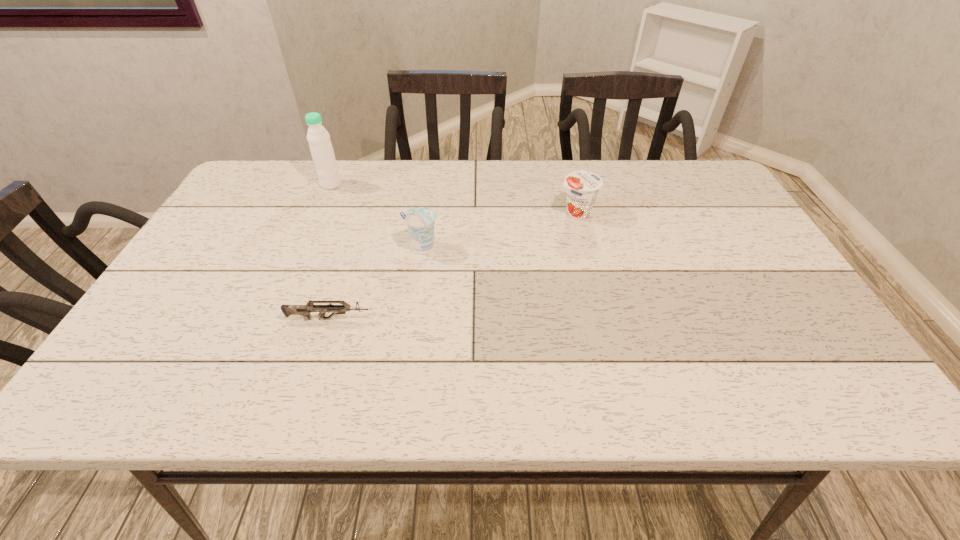
Find the location of a particular element. This screenshot has height=540, width=960. vacant space located on the back of the nearer yogurt is located at coordinates coord(428,200).

Locate an element on the screen. This screenshot has width=960, height=540. free point located aimed along the barrel of the gun is located at coordinates (551, 319).

Find the location of a particular element. This screenshot has width=960, height=540. water bottle located in the far edge section of the desktop is located at coordinates (318, 137).

Locate an element on the screen. This screenshot has width=960, height=540. yogurt at the far edge is located at coordinates [x=582, y=187].

The width and height of the screenshot is (960, 540). I want to click on free space at the far edge of the desktop, so click(x=395, y=163).

In the image, there is a desktop. Where is `vacant space at the near edge`? The image size is (960, 540). vacant space at the near edge is located at coordinates (729, 387).

In the image, there is a desktop. At what (x,y) coordinates should I click in order to perform the action: click on vacant area at the right edge. Please return your answer as a coordinate pair (x, y). Looking at the image, I should click on (813, 325).

You are a GUI agent. You are given a task and a screenshot of the screen. Output one action in this format:
    pyautogui.click(x=<x>, y=<y>)
    Task: Click on the free space at the far right corner of the desktop
    The width and height of the screenshot is (960, 540).
    Given the screenshot: What is the action you would take?
    pyautogui.click(x=669, y=161)

This screenshot has width=960, height=540. Find the location of `vacant space that's between the second nearest object and the third nearest object`. vacant space that's between the second nearest object and the third nearest object is located at coordinates (499, 230).

Identify the location of vacant area that lies between the farthest object and the left yogurt. (376, 216).